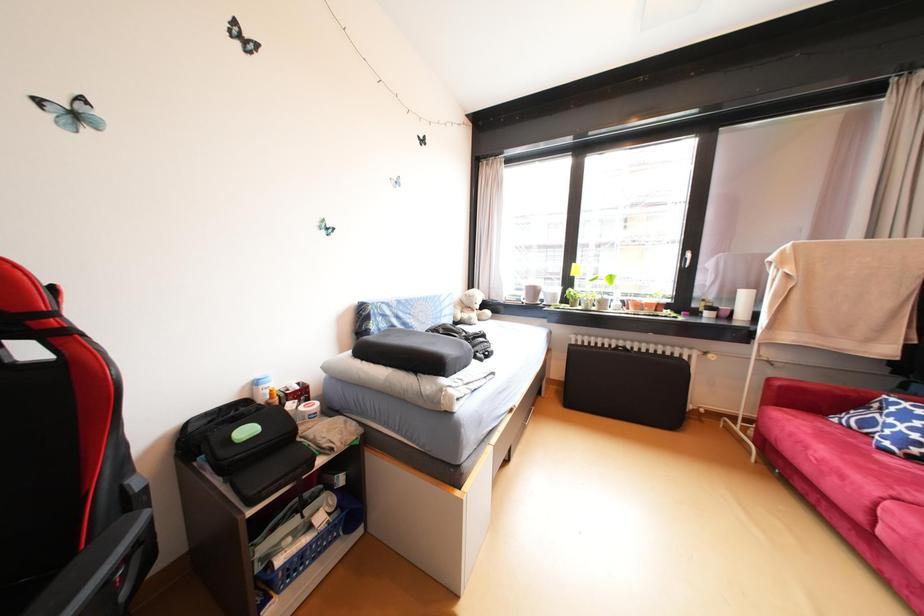
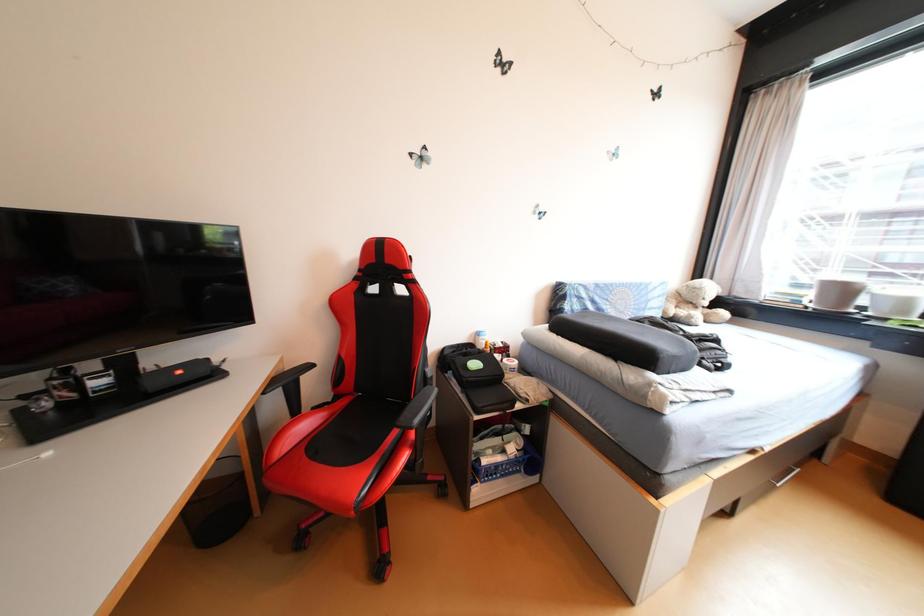
Question: The camera is either moving clockwise (left) or counter-clockwise (right) around the object. The first image is from the beginning of the video and the second image is from the end. Is the camera moving left or right when shooting the video?

Choices:
 (A) Left
 (B) Right

Answer: (B)